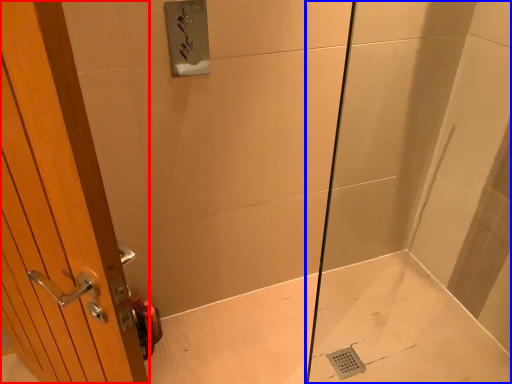
Question: Which of the following is the closest to the observer, door (highlighted by a red box) or shower door (highlighted by a blue box)?

Choices:
 (A) door
 (B) shower door

Answer: (A)